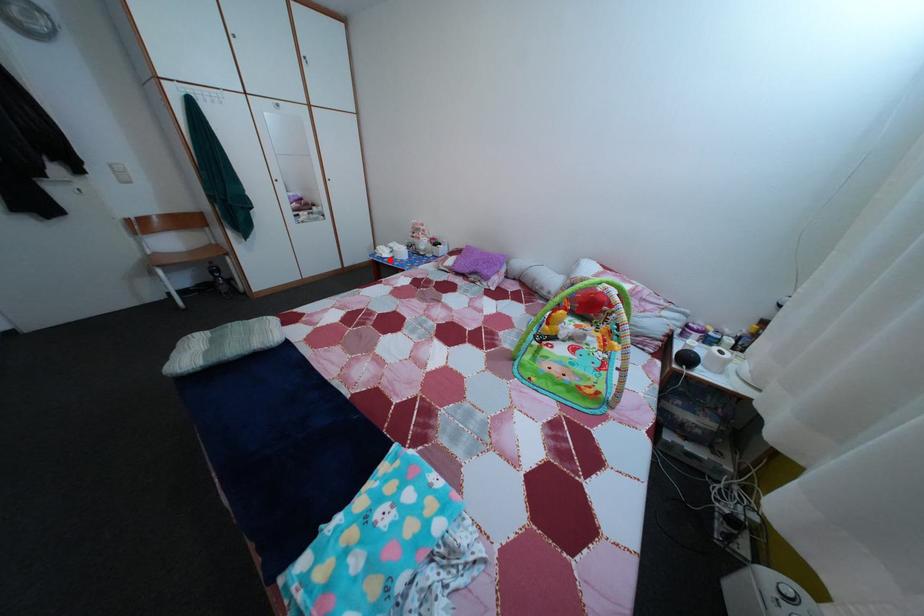
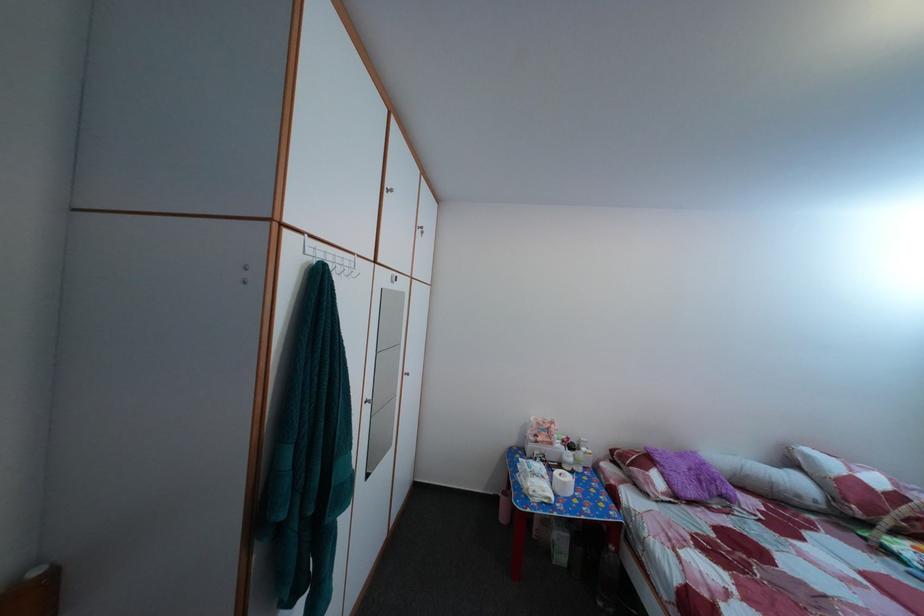
Question: I am providing you with two images of the same scene from different viewpoints. Image1 has a red point marked. In image2, the corresponding 3D location appears at what relative position? Reply with the corresponding letter.

Choices:
 (A) Closer
 (B) Farther

Answer: (B)